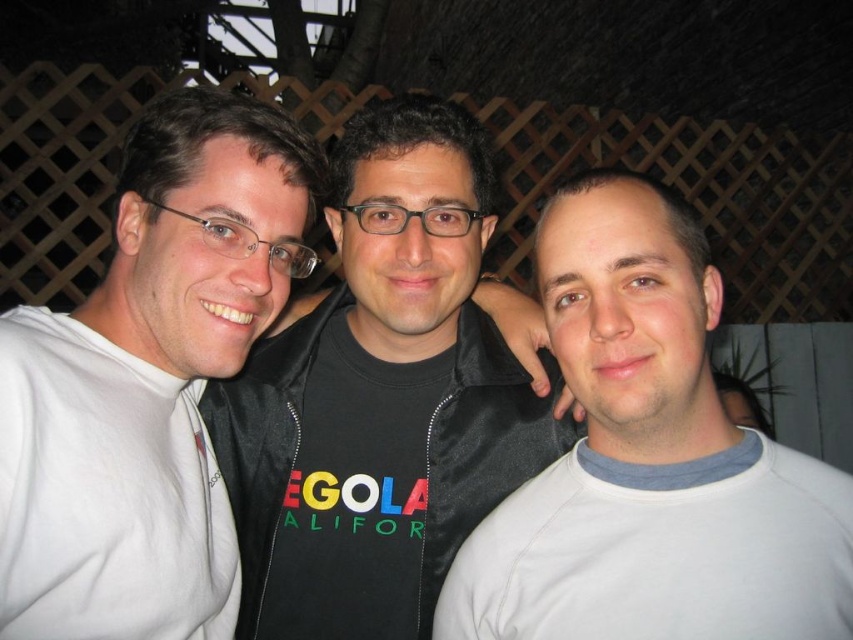
In the scene shown: Is white matte shirt at left to the left of white cotton shirt at right from the viewer's perspective?

Yes, white matte shirt at left is to the left of white cotton shirt at right.

Is white matte shirt at left wider than white cotton shirt at right?

No, white matte shirt at left is not wider than white cotton shirt at right.

Who is more forward, (94,458) or (683,557)?

Point (683,557) is in front.

Identify the location of white matte shirt at left. The height and width of the screenshot is (640, 853). (148, 381).

Is black matte jacket at center positioned behind white matte shirt at center?

Yes.

At what (x,y) coordinates should I click in order to perform the action: click on black matte jacket at center. Please return your answer as a coordinate pair (x, y). This screenshot has height=640, width=853. Looking at the image, I should click on (380, 396).

This screenshot has height=640, width=853. In order to click on black matte jacket at center in this screenshot , I will do `click(380, 396)`.

Can you confirm if black matte jacket at center is wider than white matte shirt at left?

Yes, black matte jacket at center is wider than white matte shirt at left.

Who is more forward, [426,435] or [123,212]?

Point [123,212] is in front.

The height and width of the screenshot is (640, 853). I want to click on black matte jacket at center, so click(x=380, y=396).